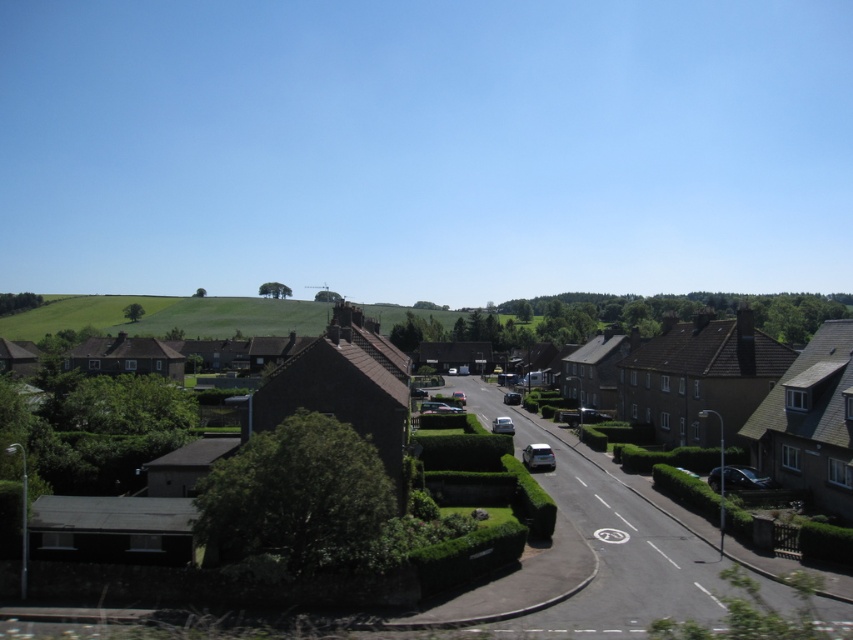
You are a gardener planning to plant flowers between the green leafy hedge at center and the green grassy hillside at center. Which area has more space available for planting?

The green grassy hillside at center has more space available for planting because its width is greater than the green leafy hedge at center.

You are a delivery driver approaching the brown brick houses at center and the green leafy hedge at center. Which object will you pass first as you drive along the road?

The green leafy hedge at center will be passed first because it is narrower than the brown brick houses at center, allowing the vehicle to navigate around it sooner.

You are a delivery driver planning to drive a truck that is 10 meters long through this suburban neighborhood. The truck needs to navigate around the brown brick houses at center and the green grassy hillside at center. Based on their sizes, which of these two objects would pose a greater challenge for the truck to maneuver around?

The green grassy hillside at center is larger than the brown brick houses at center, so it would pose a greater challenge for the truck to maneuver around.